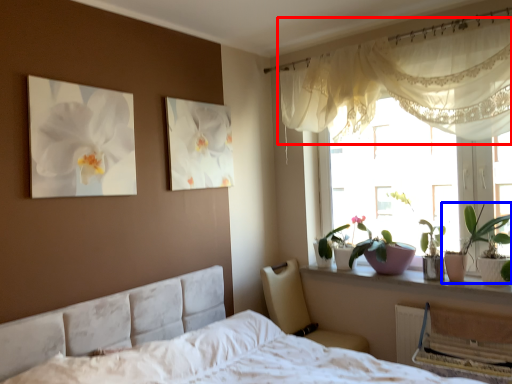
Question: Which point is closer to the camera, curtain (highlighted by a red box) or houseplant (highlighted by a blue box)?

Choices:
 (A) curtain
 (B) houseplant

Answer: (A)